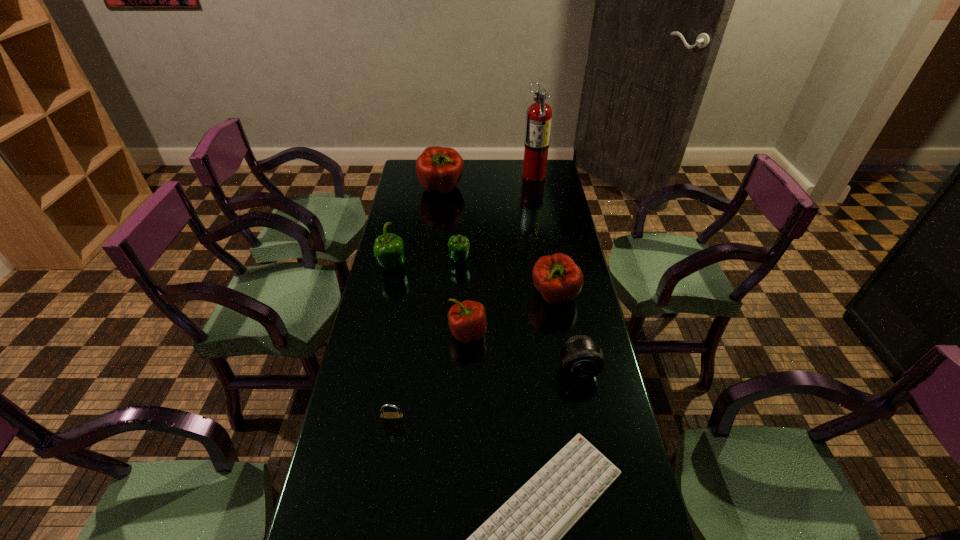
You are a GUI agent. You are given a task and a screenshot of the screen. Output one action in this format:
    pyautogui.click(x=<x>, y=<y>)
    Task: Click on the free space between the sixth farthest object and the left green bell pepper
    The height and width of the screenshot is (540, 960).
    Given the screenshot: What is the action you would take?
    pyautogui.click(x=430, y=300)

Find the location of `empty space between the farthest bell pepper and the telephoto lens`. empty space between the farthest bell pepper and the telephoto lens is located at coordinates (510, 279).

At what (x,y) coordinates should I click in order to perform the action: click on object that is the second nearest to the left green bell pepper. Please return your answer as a coordinate pair (x, y). The height and width of the screenshot is (540, 960). Looking at the image, I should click on (467, 320).

Identify which object is the sixth closest to the nearest pink bell pepper. Please provide its 2D coordinates. Your answer should be formatted as a tuple, i.e. [(x, y)], where the tuple contains the x and y coordinates of a point satisfying the conditions above.

[(523, 539)]

In order to click on bell pepper identified as the second closest to the third nearest object in this screenshot , I will do `click(467, 320)`.

Where is `bell pepper that is the second closest to the shortest object`? bell pepper that is the second closest to the shortest object is located at coordinates (557, 277).

Identify which pink bell pepper is located as the nearest to the nearest pink bell pepper. Please provide its 2D coordinates. Your answer should be formatted as a tuple, i.e. [(x, y)], where the tuple contains the x and y coordinates of a point satisfying the conditions above.

[(557, 277)]

Identify which pink bell pepper is the second closest to the computer keyboard. Please provide its 2D coordinates. Your answer should be formatted as a tuple, i.e. [(x, y)], where the tuple contains the x and y coordinates of a point satisfying the conditions above.

[(557, 277)]

Where is `vacant point that satisfies the following two spatial constraints: 1. on the front side of the second nearest bell pepper; 2. on the right side of the right green bell pepper`? This screenshot has height=540, width=960. vacant point that satisfies the following two spatial constraints: 1. on the front side of the second nearest bell pepper; 2. on the right side of the right green bell pepper is located at coordinates (458, 296).

Identify the location of free spot that satisfies the following two spatial constraints: 1. on the back side of the second nearest pink bell pepper; 2. on the left side of the smallest pink bell pepper. (468, 296).